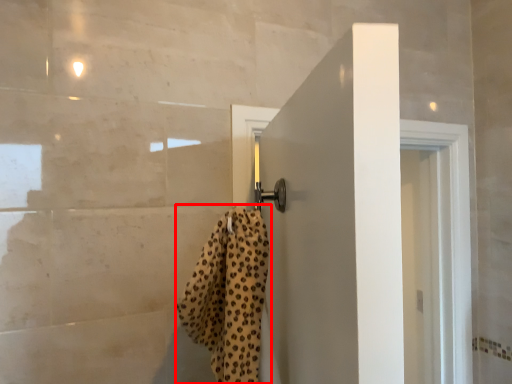
Question: Observing the image, what is the correct spatial positioning of bath towel (annotated by the red box) in reference to door?

Choices:
 (A) right
 (B) left

Answer: (B)